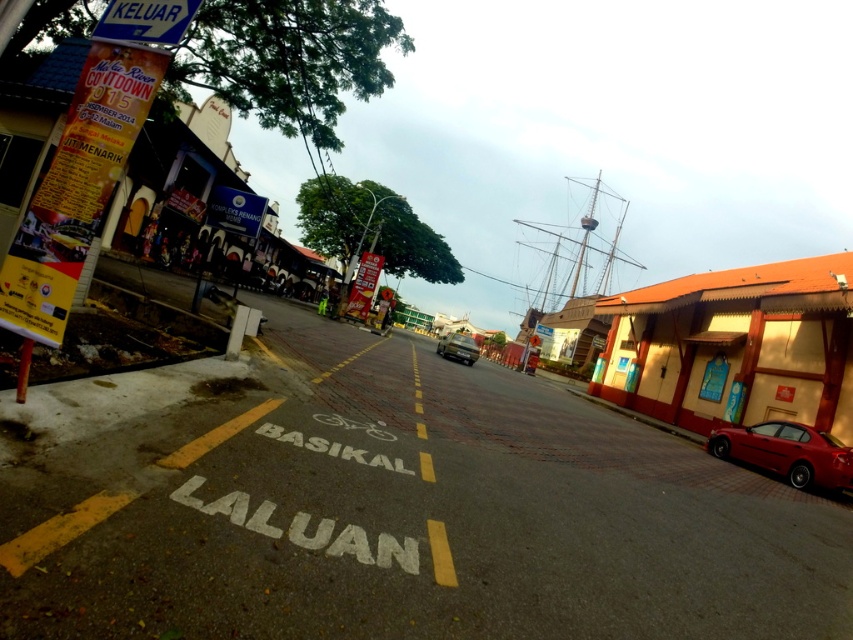
You are standing at the center of the road marked with yellow dashed lines and the words BASIKAL LALUAN. You want to move to the shiny red car at lower right. Which direction should you walk to reach it?

The shiny red car at lower right is located at point (787, 452), so you should walk towards the lower right direction to reach it.

You are a pedestrian standing on the sidewalk and want to cross the road to reach the Melaka River Countdown 2015 banner on the left. The road has a bicycle lane marked with yellow dashed lines and the words BASIKAL LALUAN. There are two cars in your view, a shiny red car at lower right and a metallic silver car at center. Which car is closer to the bicycle lane?

The shiny red car at lower right is closer to the bicycle lane because it is located below the metallic silver car at center, meaning it is positioned nearer to the road edge where the bicycle lane is marked.